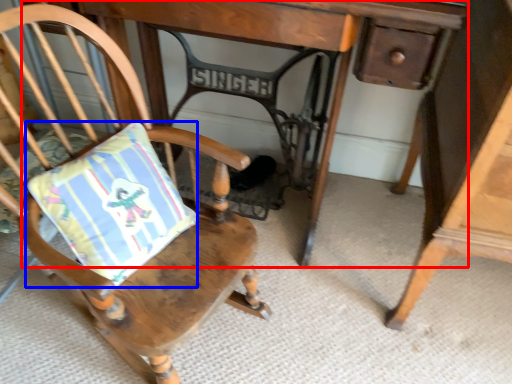
Question: Which point is further to the camera, table (highlighted by a red box) or pillow (highlighted by a blue box)?

Choices:
 (A) table
 (B) pillow

Answer: (A)